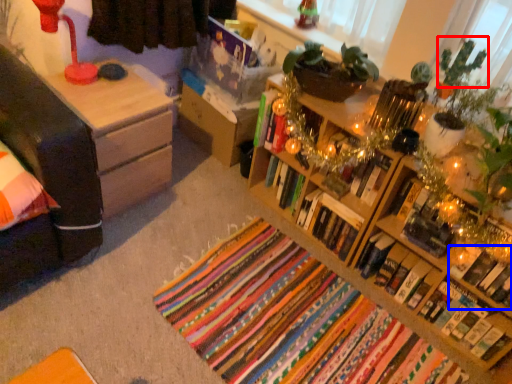
Question: Among these objects, which one is farthest to the camera, christmas decoration (highlighted by a red box) or book (highlighted by a blue box)?

Choices:
 (A) christmas decoration
 (B) book

Answer: (B)